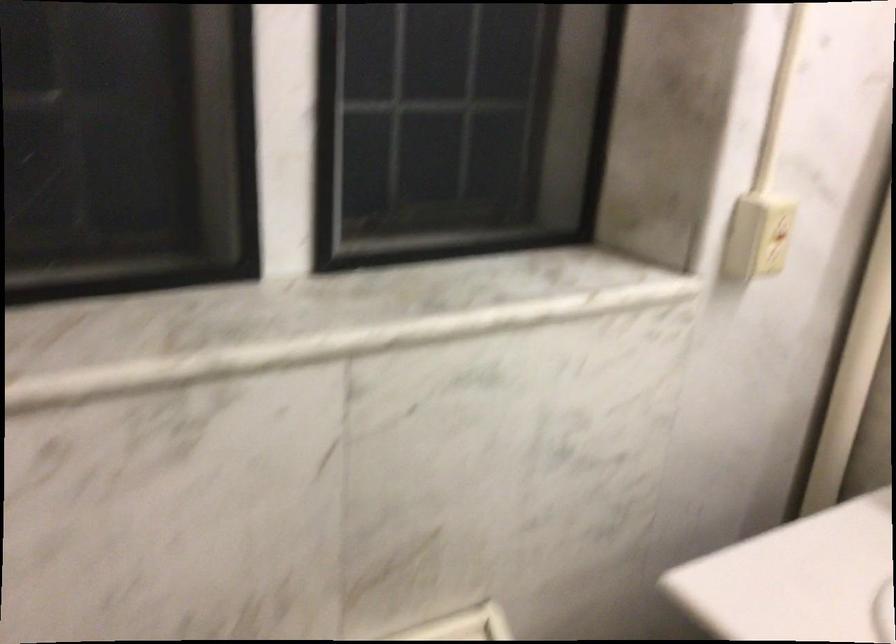
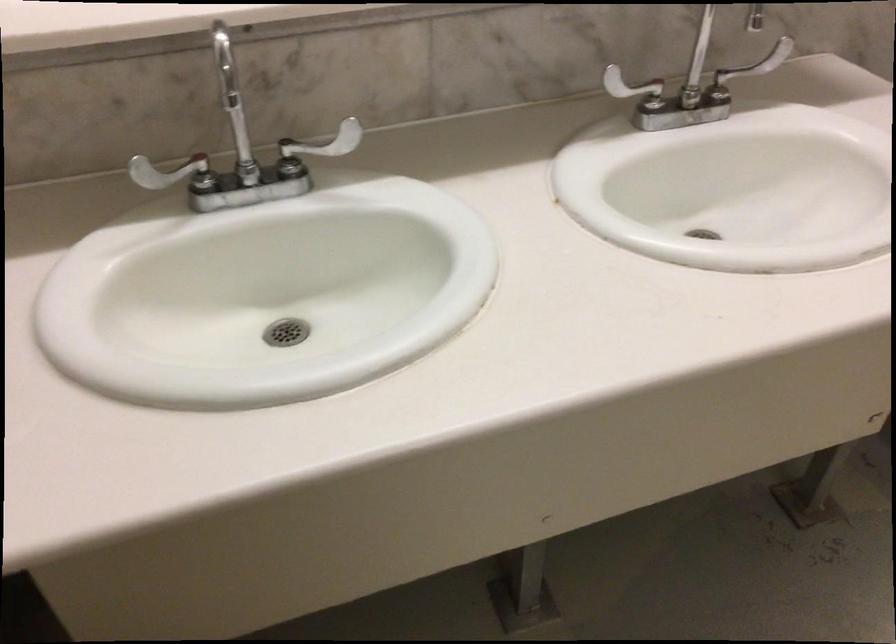
The first image is from the beginning of the video and the second image is from the end. How did the camera likely rotate when shooting the video?

The camera rotated toward right-down.